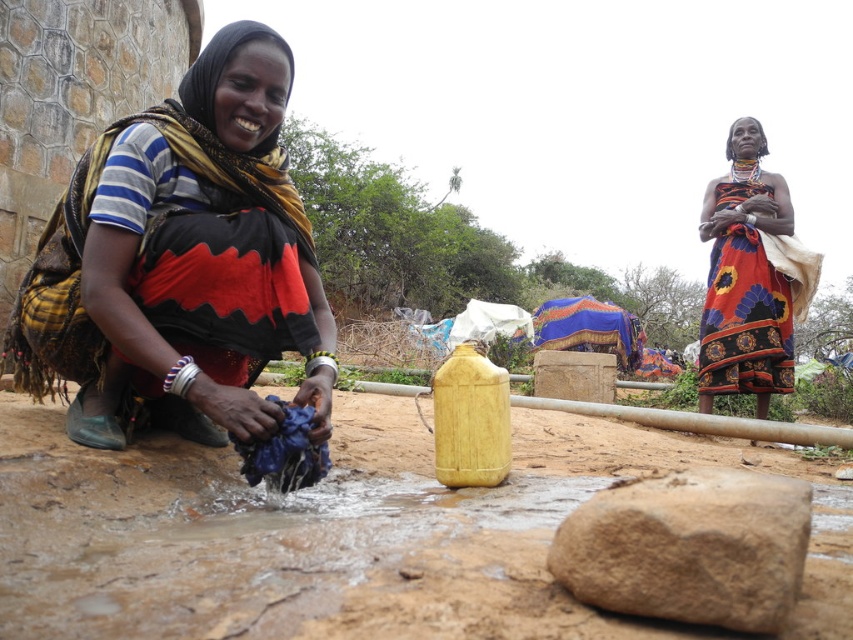
You are a traveler who just arrived at this rural area and need to determine which object is taller between the matte black scarf at lower left and the brown rough rock at lower center. Based on the scene, which one is taller?

The matte black scarf at lower left is much taller than the brown rough rock at lower center.

You are a traveler who just arrived at this rural area. You see the matte black scarf at lower left and the brown rough rock at lower center. Which object is closer to your eye level?

The matte black scarf at lower left is above the brown rough rock at lower center, so it is closer to your eye level.

You are a traveler who wants to place a small backpack between the brown rough rock at lower center and the floral fabric dress at center. Based on the scene, which object should you place the backpack closer to in order to have it visible to someone approaching from the front?

You should place the backpack closer to the brown rough rock at lower center because it is closer to the viewer than the floral fabric dress at center, making it more visible to someone approaching from the front.